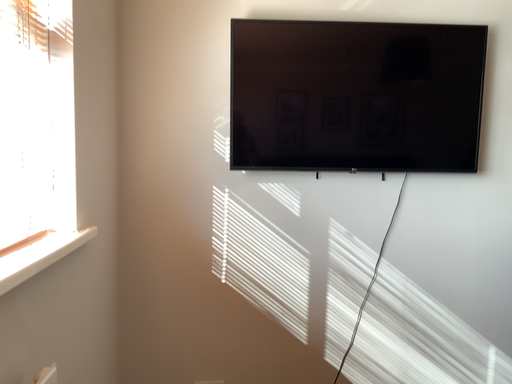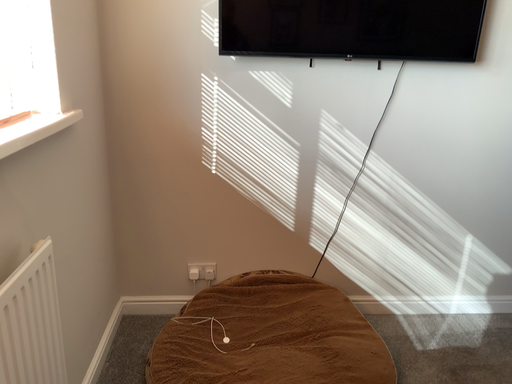
Question: Which way did the camera rotate in the video?

Choices:
 (A) rotated downward
 (B) rotated upward

Answer: (A)